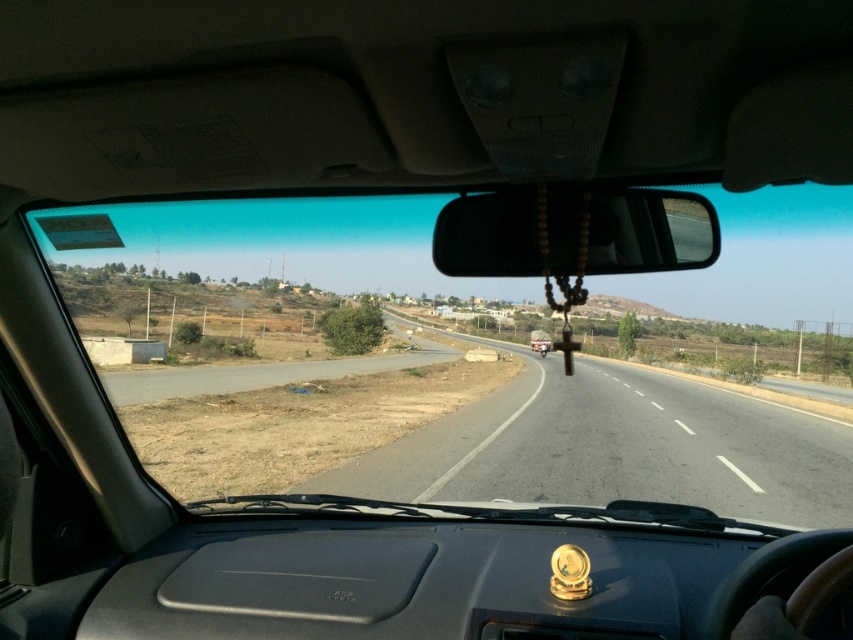
Question: Can you confirm if wooden beads at center is positioned above metallic silver helmet at center?

Choices:
 (A) yes
 (B) no

Answer: (A)

Question: Does wooden beads at center appear on the left side of metallic silver helmet at center?

Choices:
 (A) no
 (B) yes

Answer: (B)

Question: Where is wooden beads at center located in relation to metallic silver helmet at center in the image?

Choices:
 (A) right
 (B) left

Answer: (B)